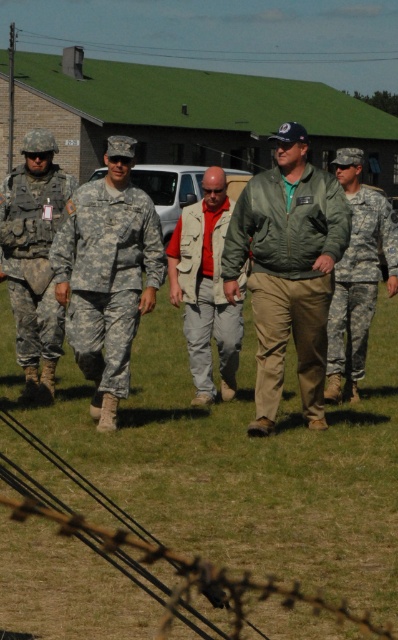
You are a drone operator tasked with identifying the location of a specific point in the image. The point is located at coordinates point (107, 276). Based on the scene description, can you determine what object or area this point corresponds to?

The point (107, 276) is on camouflage fabric uniform at center.

You are a drone operator controlling a drone that has a maximum effective range of 10 meters. Your drone is currently positioned at the camera location. You need to capture a clear image of the camouflage uniform at center. Can your drone reach it?

The camouflage uniform at center is 9.14 meters away from camera, so yes, the drone can reach it since the distance is within the 10 meters maximum effective range.

You are a photographer trying to capture a candid shot of the khaki fabric vest at center. You are positioned at the point with coordinates (206, 292). Can you take a clear photo of the khaki fabric vest at center without moving from your current position?

The khaki fabric vest at center is located at point (206, 292), so you are exactly at the same location as the khaki fabric vest at center. You cannot take a photo of it from this position because you are at the same spot.